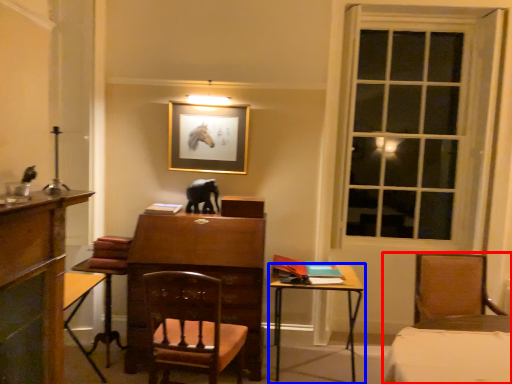
Question: Which point is closer to the camera, chair (highlighted by a red box) or table (highlighted by a blue box)?

Choices:
 (A) chair
 (B) table

Answer: (A)